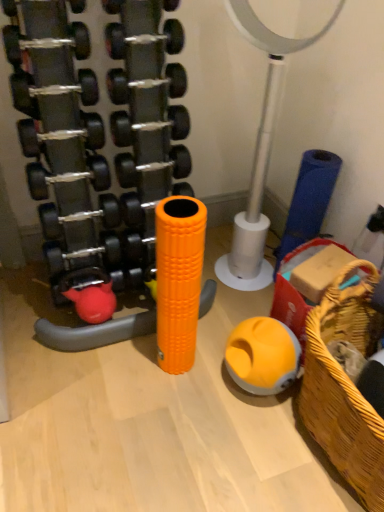
You are a GUI agent. You are given a task and a screenshot of the screen. Output one action in this format:
    pyautogui.click(x=<x>, y=<y>)
    Task: Click on the vacant space behind orange foam roller at center, marked as the first toy in a left-to-right arrangement
    This screenshot has height=512, width=384.
    Given the screenshot: What is the action you would take?
    pyautogui.click(x=209, y=322)